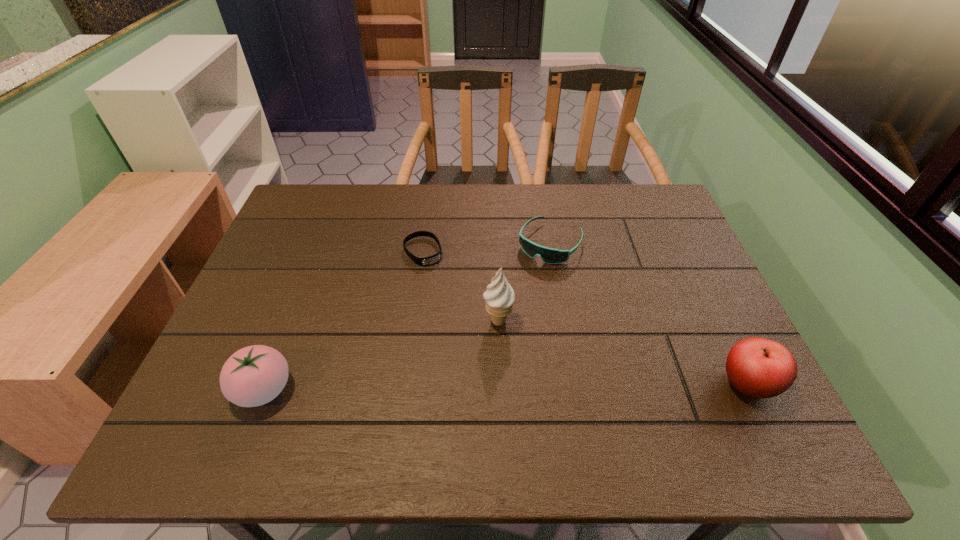
Where is `tomato`? Image resolution: width=960 pixels, height=540 pixels. tomato is located at coordinates click(x=253, y=376).

Locate an element on the screen. Image resolution: width=960 pixels, height=540 pixels. the rightmost object is located at coordinates (760, 368).

Where is `sunglasses`? This screenshot has height=540, width=960. sunglasses is located at coordinates (548, 255).

The width and height of the screenshot is (960, 540). In order to click on the fourth tallest object in this screenshot , I will do `click(548, 255)`.

The image size is (960, 540). Find the location of `the fourth object from right to left`. the fourth object from right to left is located at coordinates (434, 258).

Locate an element on the screen. The height and width of the screenshot is (540, 960). wristband is located at coordinates (434, 258).

Locate an element on the screen. the third farthest object is located at coordinates (499, 297).

Image resolution: width=960 pixels, height=540 pixels. What are the coordinates of `the tallest object` in the screenshot? It's located at (499, 297).

The width and height of the screenshot is (960, 540). I want to click on vacant space located on the right of the leftmost object, so click(384, 389).

Identify the location of free location located 0.210m on the left of the apple. (619, 384).